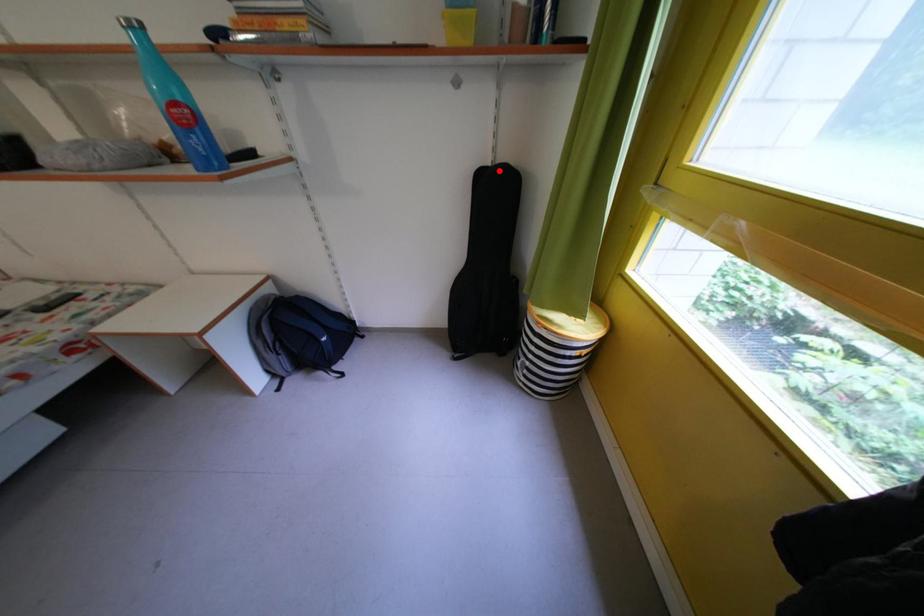
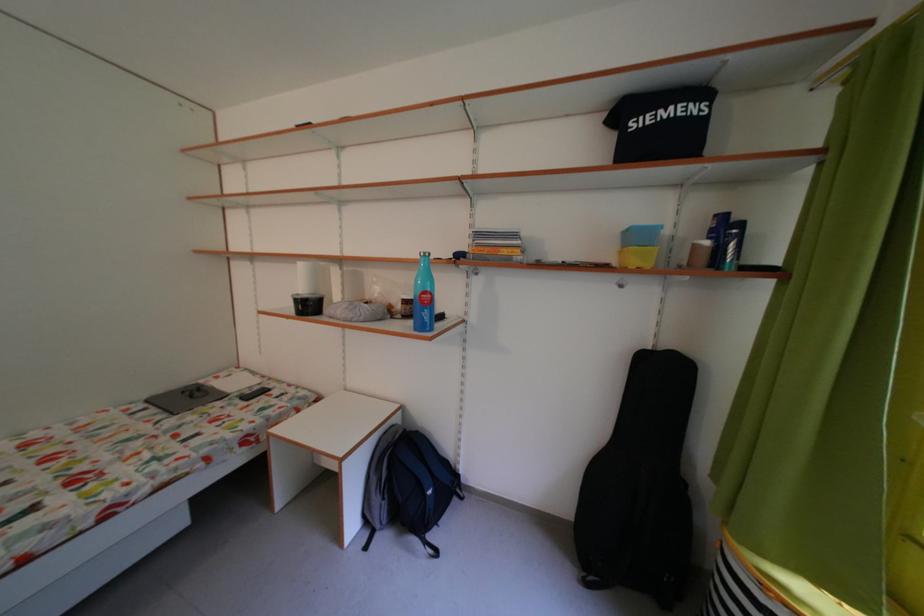
In the second image, find the point that corresponds to the highlighted location in the first image.

(661, 354)